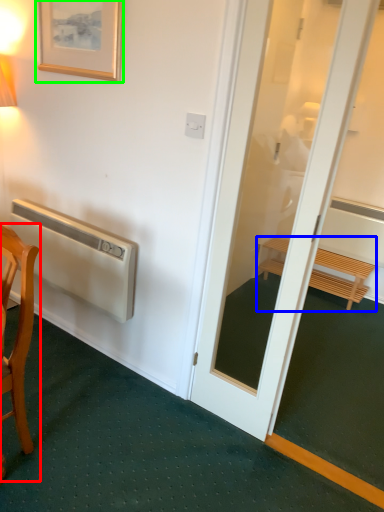
Question: Which is nearer to the chair (highlighted by a red box)? furniture (highlighted by a blue box) or picture frame (highlighted by a green box).

Choices:
 (A) furniture
 (B) picture frame

Answer: (B)